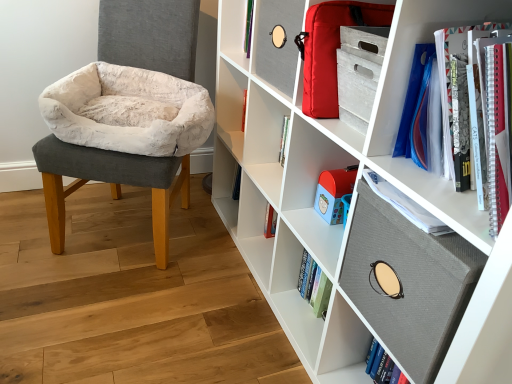
Question: Is white matte bookshelf at center, the 1th shelf when ordered from top to bottom, in front of or behind matte red bag at upper right, which ranks as the second cabinet in bottom-to-top order, in the image?

Choices:
 (A) front
 (B) behind

Answer: (B)

Question: Based on their sizes in the image, would you say white matte bookshelf at center, the 1th shelf when ordered from top to bottom, is bigger or smaller than matte red bag at upper right, which ranks as the second cabinet in bottom-to-top order?

Choices:
 (A) big
 (B) small

Answer: (A)

Question: Estimate the real-world distances between objects in this image. Which object is closer to the matte red bag at upper right, which ranks as the second cabinet in bottom-to-top order?

Choices:
 (A) spiral-bound notebooks at upper right, which is counted as the second shelf, starting from the top
 (B) white matte bookshelf at center, which is counted as the 3th shelf, starting from the bottom
 (C) white plush cushion at left
 (D) white fabric bookshelf at upper right, arranged as the 1th shelf when ordered from the bottom
 (E) textured gray board at upper right, which ranks as the 2th cabinet in top-to-bottom order

Answer: (A)

Question: Which is farther from the textured gray board at upper right, which is counted as the first cabinet, starting from the bottom?

Choices:
 (A) matte red bag at upper right, the first cabinet positioned from the top
 (B) white fabric bookshelf at upper right, which is the third shelf in top-to-bottom order
 (C) white matte bookshelf at center, the 1th shelf when ordered from top to bottom
 (D) white plush cushion at left
 (E) spiral-bound notebooks at upper right, which is counted as the second shelf, starting from the top

Answer: (D)